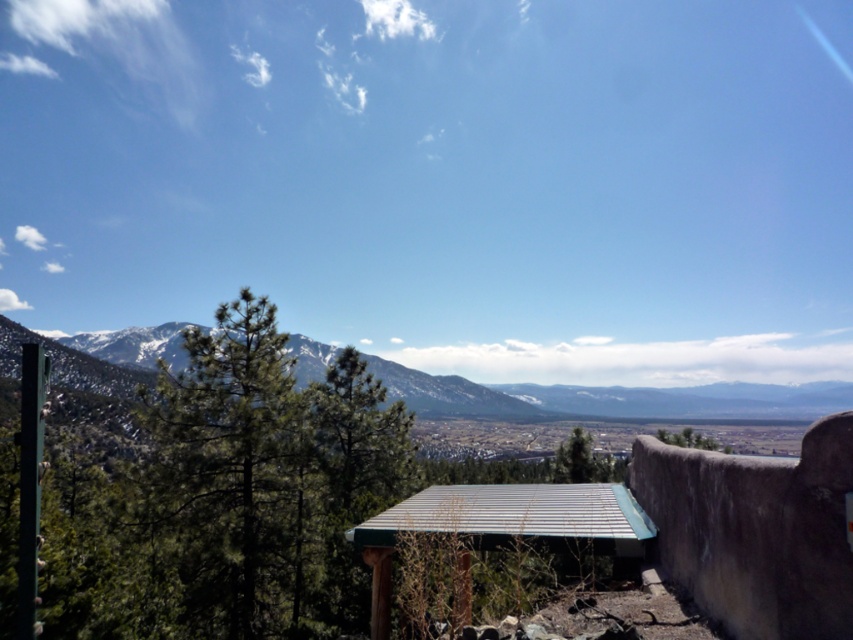
Question: Is green textured pine tree at center thinner than green matte tree at center?

Choices:
 (A) yes
 (B) no

Answer: (A)

Question: Which of the following is the closest to the observer?

Choices:
 (A) (224, 576)
 (B) (674, 442)

Answer: (A)

Question: Is green textured pine tree at center positioned in front of green matte tree at center?

Choices:
 (A) yes
 (B) no

Answer: (A)

Question: Does green textured pine tree at center have a larger size compared to green matte tree at center?

Choices:
 (A) no
 (B) yes

Answer: (A)

Question: Which of the following is the closest to the observer?

Choices:
 (A) green textured pine tree at center
 (B) green matte tree at center

Answer: (A)